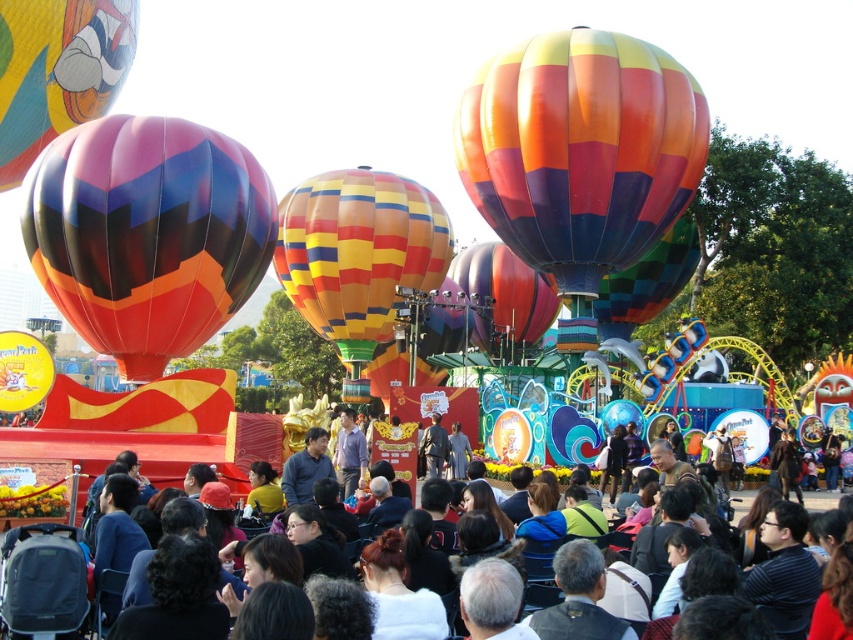
Identify the location of multicolored striped hot air balloon at center. Image resolution: width=853 pixels, height=640 pixels. (358, 253).

Does multicolored striped hot air balloon at center have a greater width compared to rainbow striped hot air balloon at center?

Yes.

Which is behind, point (340, 305) or point (643, 276)?

The point (340, 305) is more distant.

You are a GUI agent. You are given a task and a screenshot of the screen. Output one action in this format:
    pyautogui.click(x=<x>, y=<y>)
    Task: Click on the multicolored striped hot air balloon at center
    Image resolution: width=853 pixels, height=640 pixels.
    Given the screenshot: What is the action you would take?
    pyautogui.click(x=358, y=253)

Is rainbow striped balloon at upper center to the left of matte multicolored balloon at left from the viewer's perspective?

In fact, rainbow striped balloon at upper center is to the right of matte multicolored balloon at left.

Is rainbow striped balloon at upper center to the right of matte multicolored balloon at left from the viewer's perspective?

Indeed, rainbow striped balloon at upper center is positioned on the right side of matte multicolored balloon at left.

Locate an element on the screen. Image resolution: width=853 pixels, height=640 pixels. rainbow striped balloon at upper center is located at coordinates (579, 150).

Which is more to the left, rainbow striped balloon at upper center or multicolored striped hot air balloon at center?

multicolored striped hot air balloon at center is more to the left.

Locate an element on the screen. This screenshot has width=853, height=640. rainbow striped balloon at upper center is located at coordinates (579, 150).

The image size is (853, 640). In order to click on rainbow striped balloon at upper center in this screenshot , I will do `click(579, 150)`.

The image size is (853, 640). Identify the location of rainbow striped balloon at upper center. (579, 150).